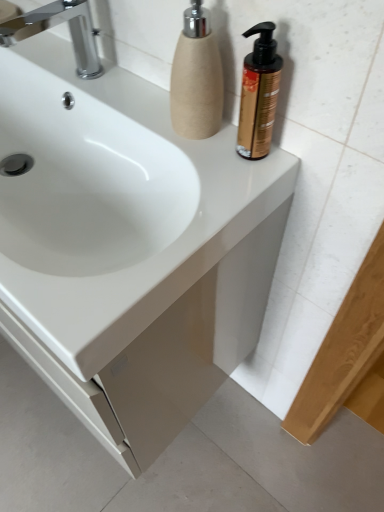
This screenshot has width=384, height=512. What are the coordinates of `vacant space to the left of gold metallic pump bottle at upper right, the first soap dispenser in the right-to-left sequence` in the screenshot? It's located at (168, 134).